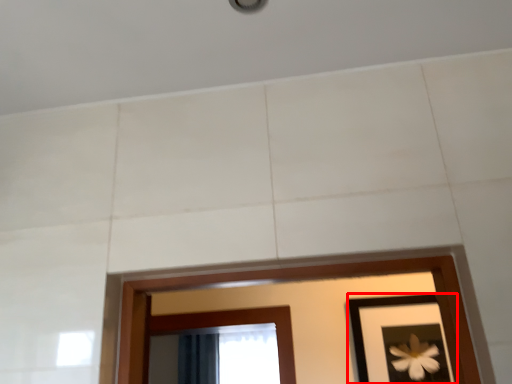
Question: From the image's perspective, where is picture frame (annotated by the red box) located relative to curtain?

Choices:
 (A) below
 (B) above

Answer: (B)